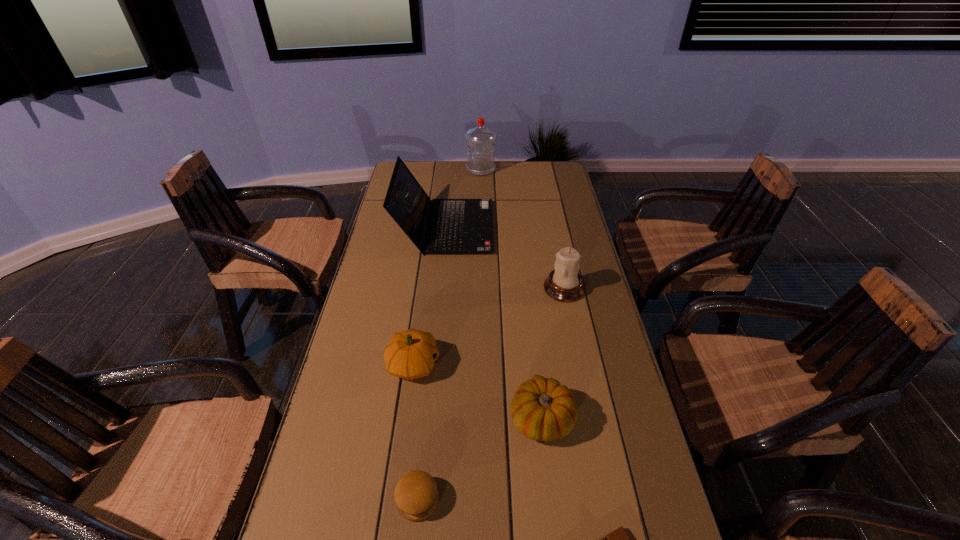
The height and width of the screenshot is (540, 960). Identify the location of gourd located in the left edge section of the desktop. (410, 354).

Find the location of a particular element. The image size is (960, 540). candle holder that is at the right edge is located at coordinates (564, 284).

The height and width of the screenshot is (540, 960). In order to click on gourd located in the right edge section of the desktop in this screenshot , I will do `click(542, 409)`.

I want to click on vacant space at the far edge of the desktop, so click(444, 160).

At what (x,y) coordinates should I click in order to perform the action: click on vacant space at the left edge. Please return your answer as a coordinate pair (x, y). This screenshot has width=960, height=540. Looking at the image, I should click on (410, 244).

You are a GUI agent. You are given a task and a screenshot of the screen. Output one action in this format:
    pyautogui.click(x=<x>, y=<y>)
    Task: Click on the vacant space at the right edge
    
    Given the screenshot: What is the action you would take?
    pyautogui.click(x=623, y=457)

Locate an element on the screen. vacant space at the far right corner of the desktop is located at coordinates (528, 164).

The image size is (960, 540). I want to click on free space between the hamburger and the farther gourd, so click(416, 432).

Where is `vacant space in between the candle holder and the right gourd`? This screenshot has height=540, width=960. vacant space in between the candle holder and the right gourd is located at coordinates (553, 354).

Locate an element on the screen. The height and width of the screenshot is (540, 960). vacant area that lies between the fifth shortest object and the laptop computer is located at coordinates (505, 258).